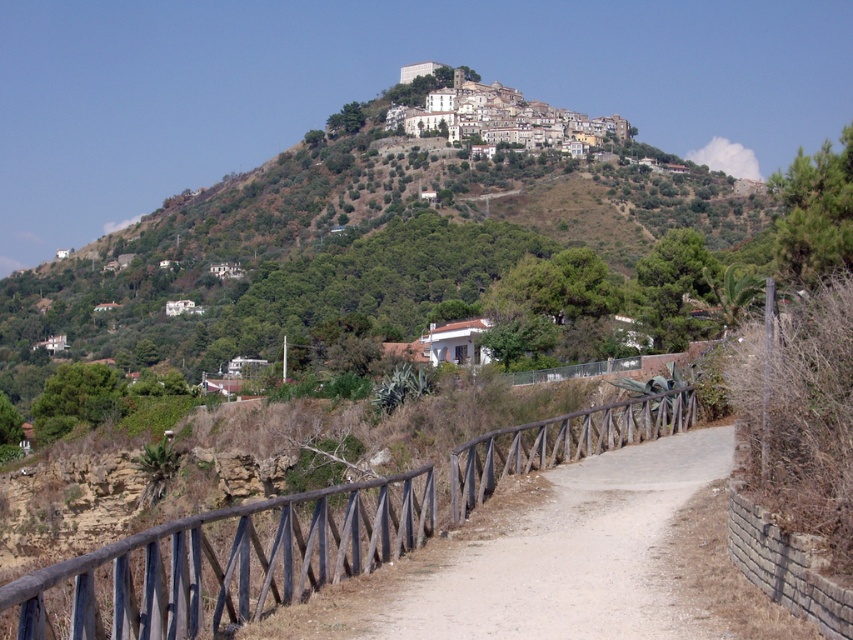
You are standing at the entrance of the town and see the point marked at coordinate (225, 561). What object is located at that point?

The point at coordinate (225, 561) indicates a brown wooden rail at center.

You are a hiker standing on the dirt path at center and want to reach the wooden rail at center to take a photo. Is the brown wooden rail at center accessible from your current position?

The brown wooden rail at center is in front of the dirt path at center, so yes, it is accessible from your current position on the dirt path at center.